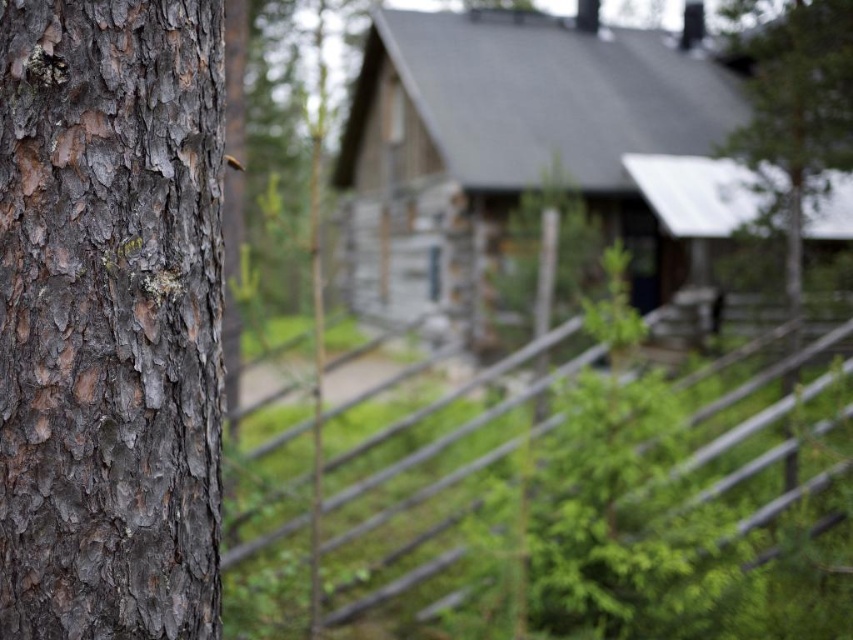
You are planning to build a new cabin similar in size to the wooden cabin at center. You have a piece of land that can accommodate a structure up to the width of the green rough bark tree at upper right. Based on the image, will your new cabin fit on this land?

The wooden cabin at center might be wider than the green rough bark tree at upper right, so there is a possibility that the new cabin may not fit on the land if the cabin is indeed wider. Further measurements would be needed to confirm.

You are standing in front of the rustic wooden cabin and notice the dark brown bark at left and the wooden cabin at center. Which object is positioned lower in the image?

The dark brown bark at left is located below the wooden cabin at center, so it is positioned lower in the image.